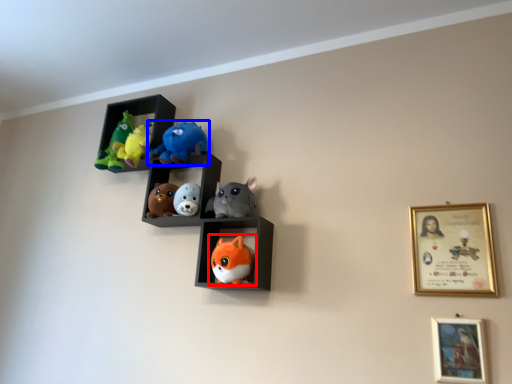
Question: Which point is closer to the camera, toy (highlighted by a red box) or toy (highlighted by a blue box)?

Choices:
 (A) toy
 (B) toy

Answer: (A)